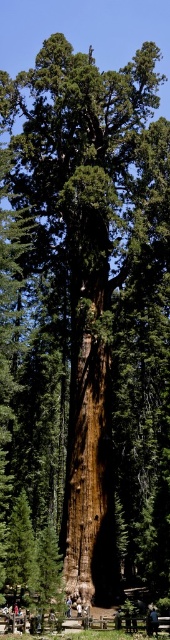
Question: Considering the relative positions of dark brown leather jacket at center and blue jeans at lower center in the image provided, where is dark brown leather jacket at center located with respect to blue jeans at lower center?

Choices:
 (A) below
 (B) above

Answer: (A)

Question: Which object appears farthest from the camera in this image?

Choices:
 (A) black leather jacket at center
 (B) blue jeans at lower center
 (C) dark brown leather jacket at center

Answer: (B)

Question: Observing the image, what is the correct spatial positioning of black leather jacket at center in reference to dark brown leather jacket at center?

Choices:
 (A) below
 (B) above

Answer: (B)

Question: Which point is farther from the camera taking this photo?

Choices:
 (A) (71, 600)
 (B) (121, 618)

Answer: (A)

Question: Which point is farther from the camera taking this photo?

Choices:
 (A) (70, 596)
 (B) (121, 620)

Answer: (A)

Question: Does black leather jacket at center have a smaller size compared to dark brown leather jacket at center?

Choices:
 (A) no
 (B) yes

Answer: (A)